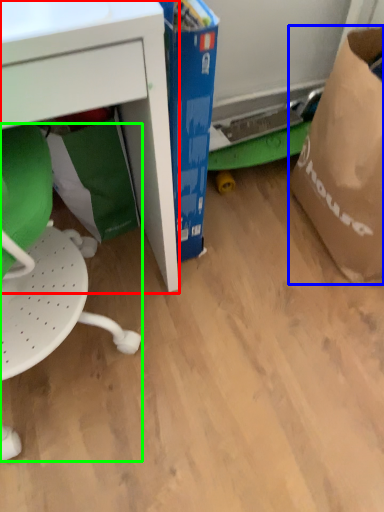
Question: Considering the real-world distances, which object is farthest from desk (highlighted by a red box)? grocery bag (highlighted by a blue box) or swivel chair (highlighted by a green box)?

Choices:
 (A) grocery bag
 (B) swivel chair

Answer: (A)